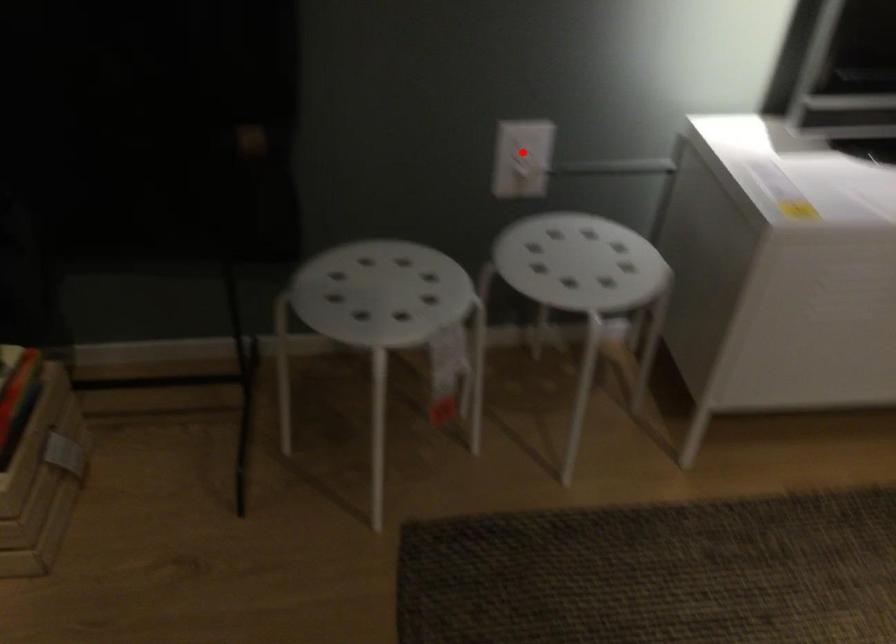
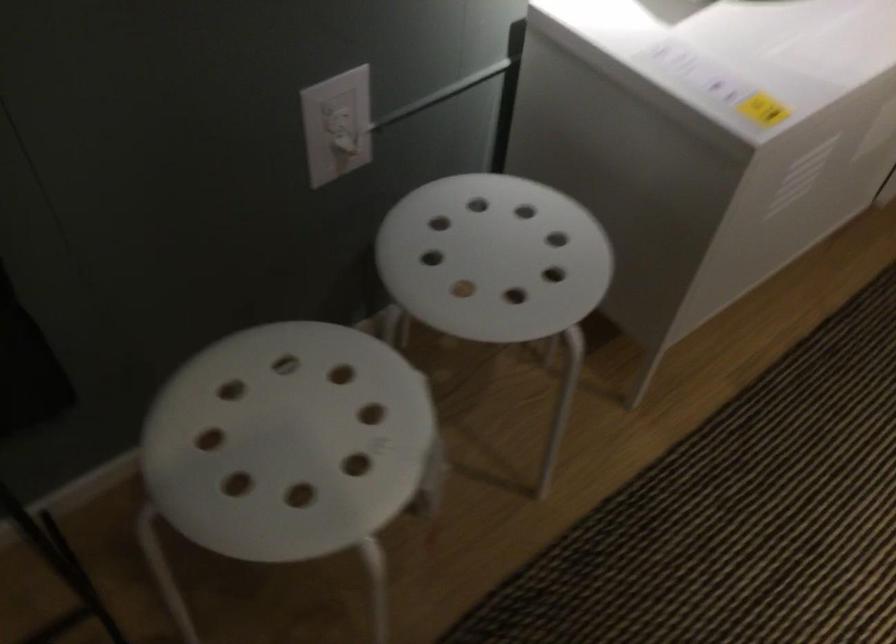
Question: I am providing you with two images of the same scene from different viewpoints. Image1 has a red point marked. In image2, the corresponding 3D location appears at what relative position? Reply with the corresponding letter.

Choices:
 (A) Closer
 (B) Farther

Answer: (A)